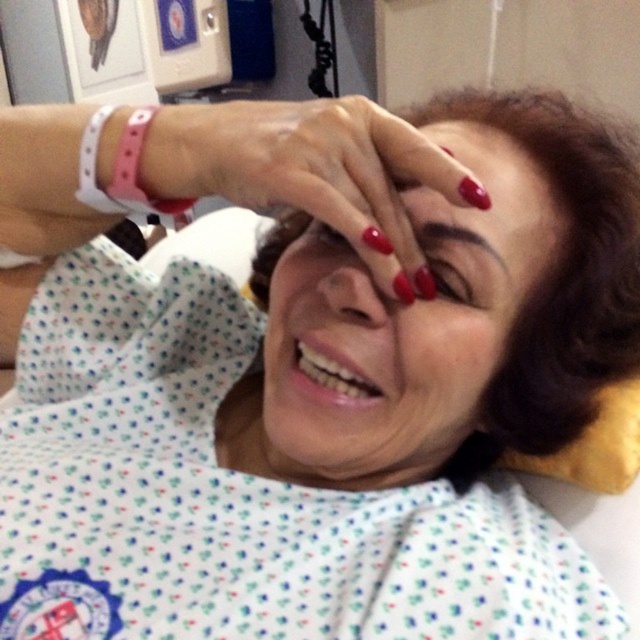
Question: Does matte red nails at center have a smaller size compared to glossy red nails at center?

Choices:
 (A) yes
 (B) no

Answer: (B)

Question: Considering the real-world distances, which object is farthest from the matte red nail at center?

Choices:
 (A) pink fabric wristband at upper left
 (B) matte red nails at center
 (C) glossy red nails at center
 (D) dark brown eyebrow at upper center

Answer: (A)

Question: Does pink rubber band at upper left have a smaller size compared to pink fabric wristband at upper left?

Choices:
 (A) yes
 (B) no

Answer: (B)

Question: Estimate the real-world distances between objects in this image. Which object is closer to the matte skin eye at center?

Choices:
 (A) glossy red nails at center
 (B) dark brown eyebrow at upper center

Answer: (B)

Question: From the image, what is the correct spatial relationship of glossy red nails at center in relation to dark brown eyebrow at upper center?

Choices:
 (A) left
 (B) right

Answer: (A)

Question: Which point is closer to the camera?

Choices:
 (A) pink fabric wristband at upper left
 (B) glossy red nails at center
 (C) dark brown eyebrow at upper center
 (D) matte skin eye at center

Answer: (B)